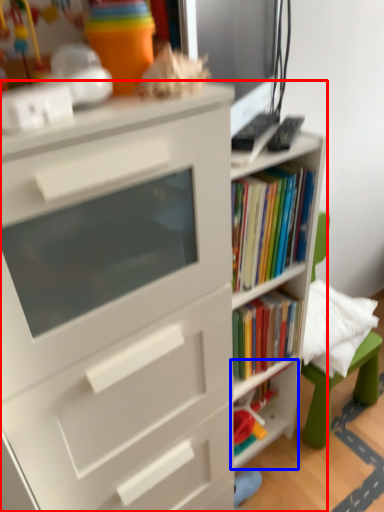
Question: Which object is further to the camera taking this photo, bookcase (highlighted by a red box) or shelf (highlighted by a blue box)?

Choices:
 (A) bookcase
 (B) shelf

Answer: (B)